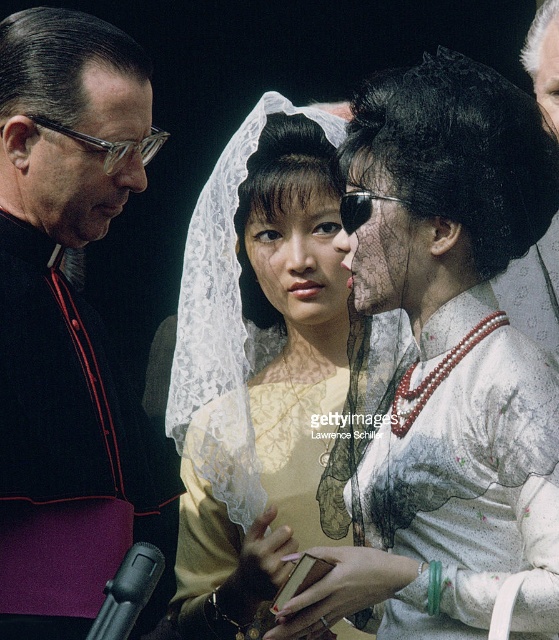
Based on the scene description, which object is taller between the matte yellow lace veil at center and the black velvet robe at left?

The matte yellow lace veil at center is much taller than the black velvet robe at left.

You are attending a religious ceremony and notice two items in the scene. The first is the black velvet robe at left and the second is the gray velvet hat at upper right. Which of these two items is taller?

The black velvet robe at left is much taller than the gray velvet hat at upper right.